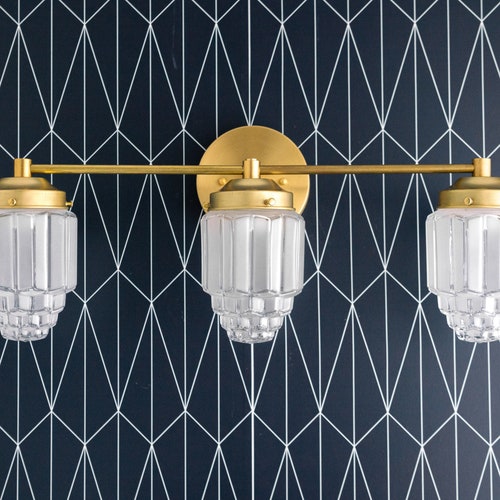
Identify the location of lights. (255, 268), (479, 255), (50, 271).